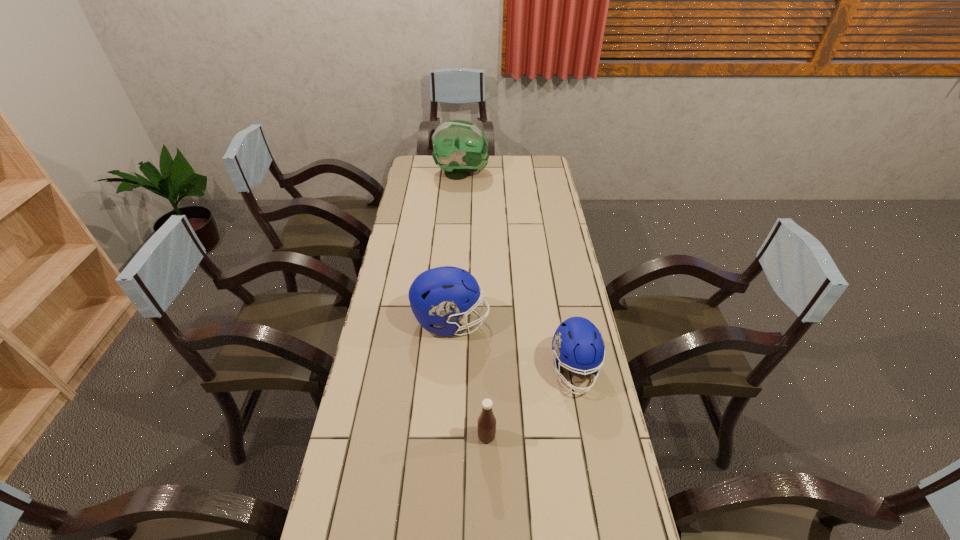
Image resolution: width=960 pixels, height=540 pixels. Find the location of `the tallest object`. the tallest object is located at coordinates (460, 147).

Where is `the farthest object`? the farthest object is located at coordinates (460, 147).

This screenshot has width=960, height=540. Find the location of `the second tallest football helmet`. the second tallest football helmet is located at coordinates (439, 296).

Locate an element on the screen. Image resolution: width=960 pixels, height=540 pixels. the rightmost football helmet is located at coordinates (577, 343).

Locate an element on the screen. the rightmost object is located at coordinates (577, 343).

Locate an element on the screen. The height and width of the screenshot is (540, 960). Tabasco sauce is located at coordinates (486, 423).

Locate an element on the screen. The image size is (960, 540). free point located on the visor of the farthest object is located at coordinates (534, 174).

Find the location of a particular element. The width and height of the screenshot is (960, 540). free point located on the front-facing side of the second shortest football helmet is located at coordinates (536, 321).

You are a GUI agent. You are given a task and a screenshot of the screen. Output one action in this format:
    pyautogui.click(x=<x>, y=<y>)
    Task: Click on the free region located on the face guard of the rightmost object
    The height and width of the screenshot is (540, 960).
    Given the screenshot: What is the action you would take?
    pyautogui.click(x=586, y=433)

Locate an element on the screen. The width and height of the screenshot is (960, 540). vacant space situated on the back of the nearest object is located at coordinates point(486,336).